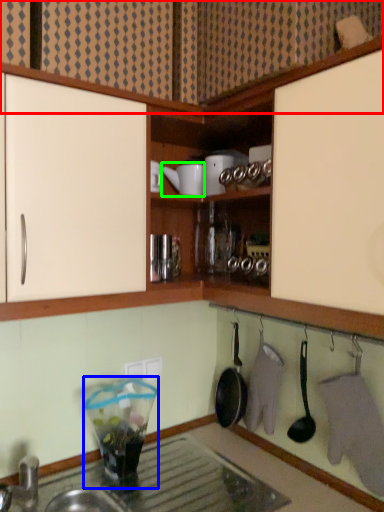
Question: Which is farther away from cabinetry (highlighted by a red box)? appliance (highlighted by a blue box) or appliance (highlighted by a green box)?

Choices:
 (A) appliance
 (B) appliance

Answer: (A)